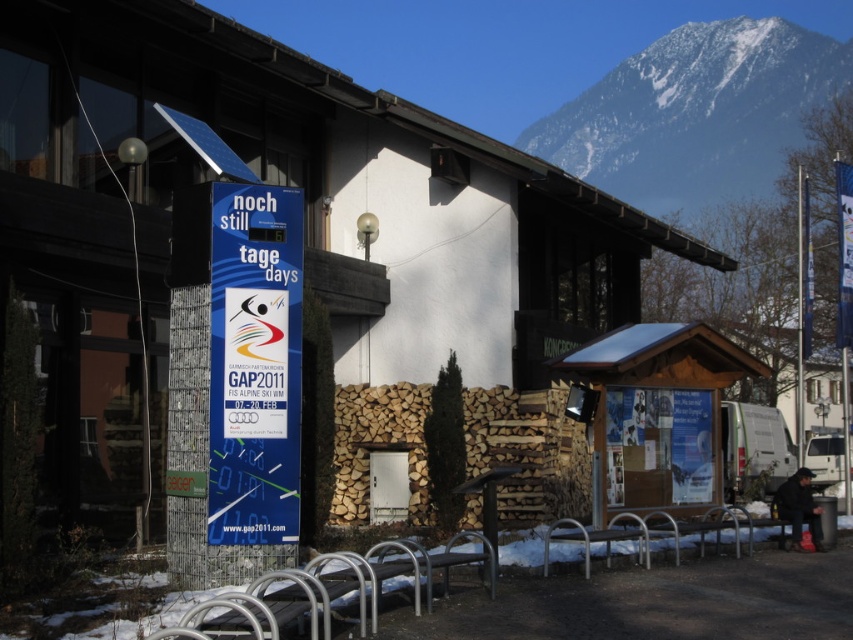
Looking at this image, you are standing in front of the building and want to take a photo that includes both the signboard and the snow on the ground. Which point, point (x=669, y=72) or point (x=297, y=490), is closer to your camera when focusing on the signboard?

Point (x=297, y=490) is closer to the camera than point (x=669, y=72) when focusing on the signboard because the signboard is closer to the camera, and point (x=297, y=490) is nearer to the signboard position.